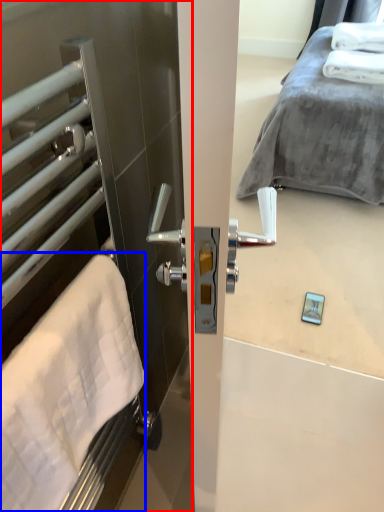
Question: Among these objects, which one is nearest to the camera, screen door (highlighted by a red box) or bath towel (highlighted by a blue box)?

Choices:
 (A) screen door
 (B) bath towel

Answer: (A)